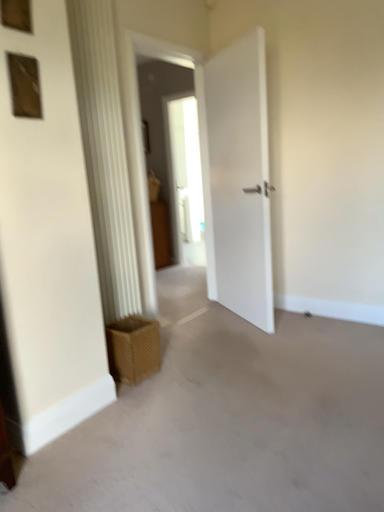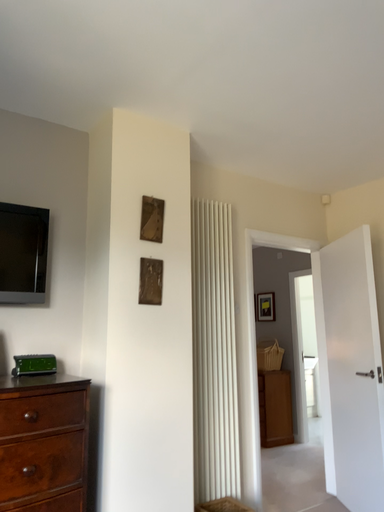
Question: Which way did the camera rotate in the video?

Choices:
 (A) rotated right
 (B) rotated left

Answer: (B)